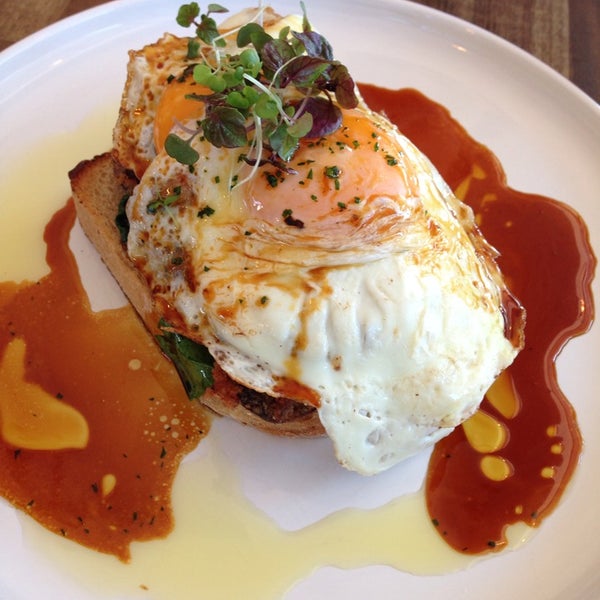
Locate an element on the screen. plate is located at coordinates (541, 131).